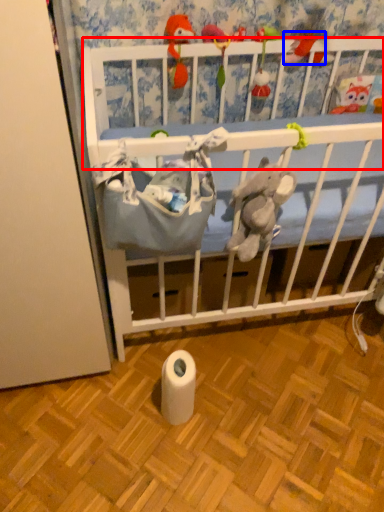
Question: Which object appears farthest to the camera in this image, infant bed (highlighted by a red box) or toy (highlighted by a blue box)?

Choices:
 (A) infant bed
 (B) toy

Answer: (B)